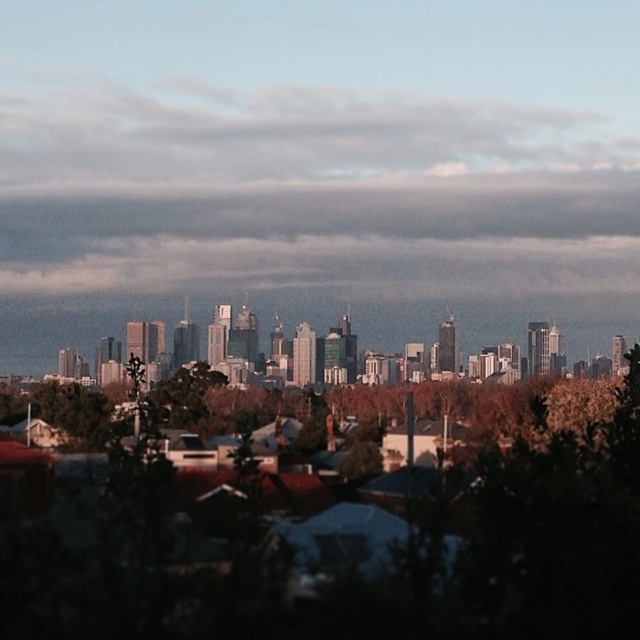
You are a city planner analyzing the skyline. You notice the green leafy tree at center and the cloudy sky at upper center. Which of these two has a greater width when viewed from the ground?

The cloudy sky at upper center has a greater width than the green leafy tree at center.

You are an architect designing a new building in this city. You want to ensure that your building doesn not block the view of the cloudy sky at upper center from the green leafy tree at center. Based on the scene description, what should you consider about the building s height?

The green leafy tree at center has a greater height compared to cloudy sky at upper center. Therefore, to avoid blocking the view of the cloudy sky at upper center from the green leafy tree at center, the new building should be designed to have a height lower than the green leafy tree at center so that the sky remains visible.